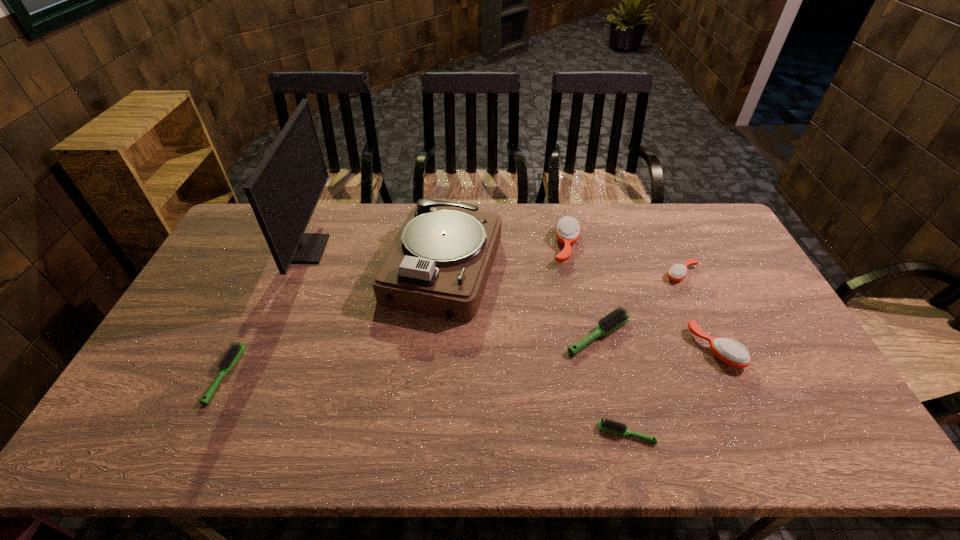
Find the location of `unoccupied position between the leftmost orange hairbrush and the biggest light hairbrush`. unoccupied position between the leftmost orange hairbrush and the biggest light hairbrush is located at coordinates (582, 291).

Image resolution: width=960 pixels, height=540 pixels. What are the coordinates of `free area in between the leftmost light hairbrush and the record player` in the screenshot? It's located at (334, 323).

Where is `free space between the leftmost light hairbrush and the tallest object`? The image size is (960, 540). free space between the leftmost light hairbrush and the tallest object is located at coordinates (267, 312).

Find the location of a particular element. Image resolution: width=960 pixels, height=540 pixels. empty location between the tallest hairbrush and the biggest light hairbrush is located at coordinates (582, 291).

At what (x,y) coordinates should I click in order to perform the action: click on free spot between the biggest light hairbrush and the record player. Please return your answer as a coordinate pair (x, y). This screenshot has width=960, height=540. Looking at the image, I should click on (520, 303).

At what (x,y) coordinates should I click in order to perform the action: click on vacant area that lies between the seventh shortest object and the smallest orange hairbrush. Please return your answer as a coordinate pair (x, y). This screenshot has width=960, height=540. Looking at the image, I should click on (563, 273).

Find the location of a particular element. free space between the record player and the shortest object is located at coordinates (535, 352).

Locate an element on the screen. vacant space in between the tallest object and the shortest object is located at coordinates (467, 341).

Find the location of a particular element. This screenshot has height=540, width=960. vacant point located between the record player and the computer monitor is located at coordinates (375, 260).

Locate which object is the seventh closest to the computer monitor. Please provide its 2D coordinates. Your answer should be formatted as a tuple, i.e. [(x, y)], where the tuple contains the x and y coordinates of a point satisfying the conditions above.

[(677, 272)]